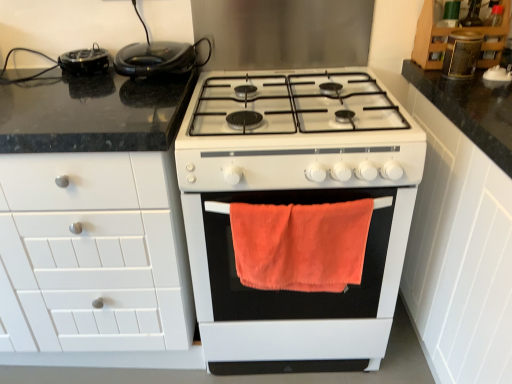
Question: Does white matte cabinet at right, which ranks as the first cabinetry in right-to-left order, appear on the left side of orange fuzzy towel at center?

Choices:
 (A) yes
 (B) no

Answer: (B)

Question: From the image's perspective, would you say white matte cabinet at right, the 3th cabinetry in the left-to-right sequence, is positioned over orange fuzzy towel at center?

Choices:
 (A) yes
 (B) no

Answer: (B)

Question: From the image's perspective, would you say white matte cabinet at right, the 3th cabinetry in the left-to-right sequence, is shown under orange fuzzy towel at center?

Choices:
 (A) yes
 (B) no

Answer: (A)

Question: Can you confirm if white matte cabinet at right, which ranks as the first cabinetry in right-to-left order, is positioned to the right of orange fuzzy towel at center?

Choices:
 (A) yes
 (B) no

Answer: (A)

Question: Is white matte cabinet at right, which ranks as the first cabinetry in right-to-left order, thinner than orange fuzzy towel at center?

Choices:
 (A) no
 (B) yes

Answer: (A)

Question: Relative to white matte cabinet at right, the 3th cabinetry in the left-to-right sequence, is black rubberized toaster at upper left in front or behind?

Choices:
 (A) front
 (B) behind

Answer: (B)

Question: Considering the positions of black rubberized toaster at upper left and white matte cabinet at right, which ranks as the first cabinetry in right-to-left order, in the image, is black rubberized toaster at upper left taller or shorter than white matte cabinet at right, which ranks as the first cabinetry in right-to-left order,?

Choices:
 (A) tall
 (B) short

Answer: (B)

Question: From the image's perspective, is black rubberized toaster at upper left above or below white matte cabinet at right, which ranks as the first cabinetry in right-to-left order?

Choices:
 (A) below
 (B) above

Answer: (B)

Question: From a real-world perspective, is black rubberized toaster at upper left positioned above or below white matte cabinet at right, which ranks as the first cabinetry in right-to-left order?

Choices:
 (A) below
 (B) above

Answer: (B)

Question: Looking at their shapes, would you say matte brown jar at upper right, which ranks as the 1th appliance in right-to-left order, is wider or thinner than white matte cabinet at right, which ranks as the first cabinetry in right-to-left order?

Choices:
 (A) thin
 (B) wide

Answer: (A)

Question: Do you think matte brown jar at upper right, which ranks as the 1th appliance in right-to-left order, is within white matte cabinet at right, which ranks as the first cabinetry in right-to-left order, or outside of it?

Choices:
 (A) outside
 (B) inside

Answer: (A)

Question: Would you say matte brown jar at upper right, positioned as the second appliance in top-to-bottom order, is to the left or to the right of white matte cabinet at right, the 3th cabinetry in the left-to-right sequence, in the picture?

Choices:
 (A) left
 (B) right

Answer: (A)

Question: Is matte brown jar at upper right, positioned as the second appliance in top-to-bottom order, bigger or smaller than white matte cabinet at right, which ranks as the first cabinetry in right-to-left order?

Choices:
 (A) small
 (B) big

Answer: (A)

Question: Is orange fuzzy towel at center to the left or to the right of matte brown jar at upper right, which is the 2th appliance from bottom to top, in the image?

Choices:
 (A) left
 (B) right

Answer: (A)

Question: From the image's perspective, is orange fuzzy towel at center above or below matte brown jar at upper right, the third appliance from the left?

Choices:
 (A) below
 (B) above

Answer: (A)